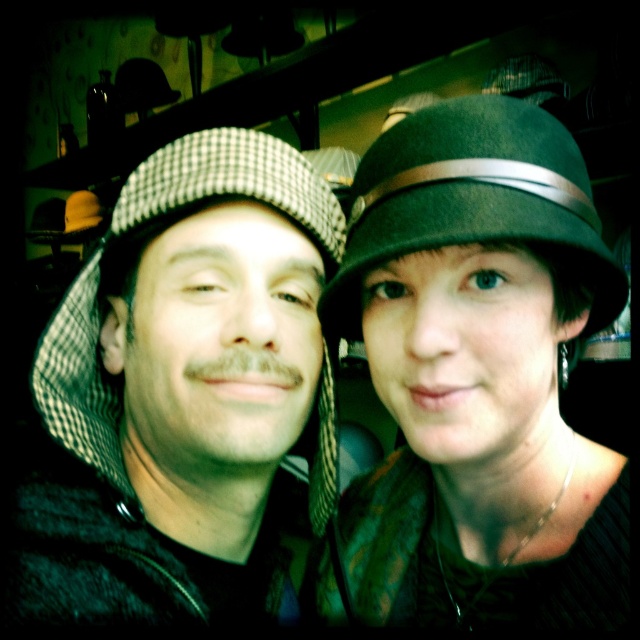
You are a photographer trying to adjust the focus between the checkered fabric hat at left and the green felt fedora at center. Given that your camera can only focus on objects within 4 inches of each other, will you need to adjust the focus for both hats?

The distance between the checkered fabric hat at left and green felt fedora at center is 4.58 inches, which exceeds the camera focus range of 4 inches. Therefore, you will need to adjust the focus for both hats separately.

You are trying to find the green felt hat at upper center in the image. The coordinates given are point [477,372]. Based on the scene description, where should you look in the image?

The green felt hat at upper center is located at point [477,372]. Since the coordinates are given, you should look at that exact point in the image.